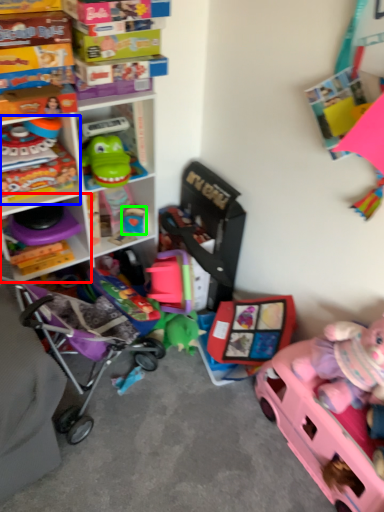
Question: Based on their relative distances, which object is farther from shelf (highlighted by a red box)? Choose from toy (highlighted by a blue box) and toy (highlighted by a green box).

Choices:
 (A) toy
 (B) toy

Answer: (B)